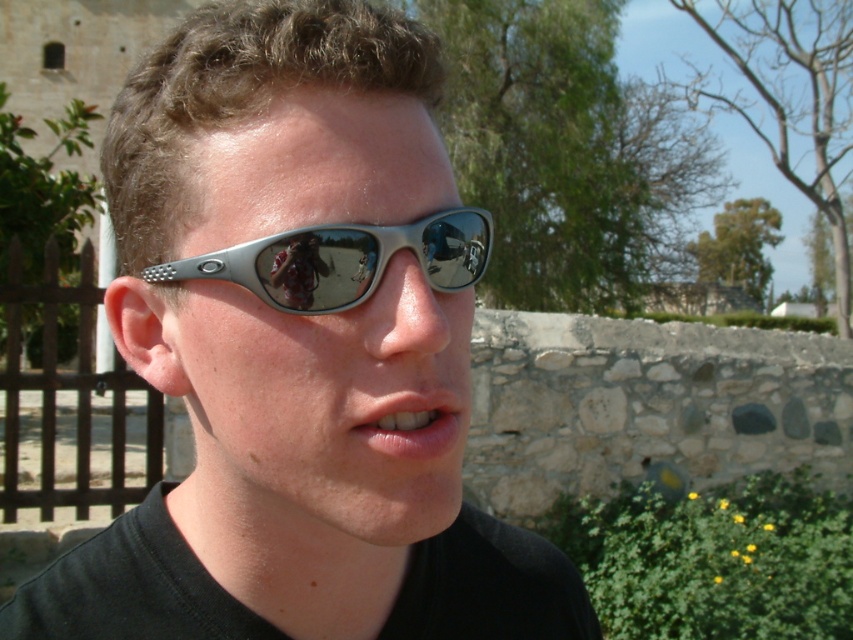
Question: Is metallic silver sunglasses at center to the right of silver metallic sunglasses at center from the viewer's perspective?

Choices:
 (A) no
 (B) yes

Answer: (A)

Question: Estimate the real-world distances between objects in this image. Which object is farther from the metallic silver sunglasses at center?

Choices:
 (A) smooth matte lips at center
 (B) silver metallic sunglasses at center

Answer: (A)

Question: Which point is closer to the camera?

Choices:
 (A) metallic silver sunglasses at center
 (B) silver metallic sunglasses at center

Answer: (B)

Question: Which of the following is the closest to the observer?

Choices:
 (A) metallic silver sunglasses at center
 (B) silver metallic sunglasses at center

Answer: (B)

Question: From the image, what is the correct spatial relationship of silver metallic sunglasses at center in relation to smooth matte lips at center?

Choices:
 (A) right
 (B) left

Answer: (B)

Question: Is metallic silver sunglasses at center bigger than silver metallic sunglasses at center?

Choices:
 (A) no
 (B) yes

Answer: (B)